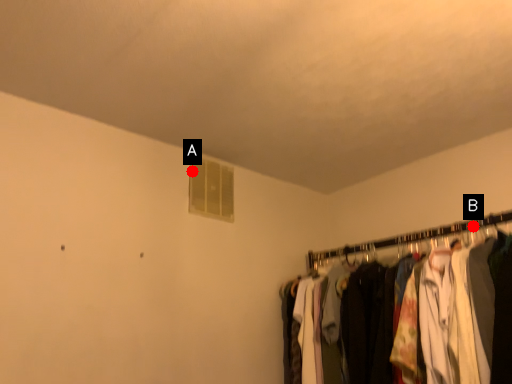
Question: Two points are circled on the image, labeled by A and B beside each circle. Which point is closer to the camera?

Choices:
 (A) A is closer
 (B) B is closer

Answer: (B)